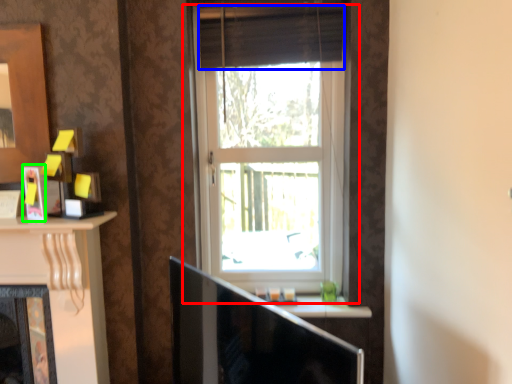
Question: Estimate the real-world distances between objects in this image. Which object is closer to window (highlighted by a red box), curtain (highlighted by a blue box) or picture frame (highlighted by a green box)?

Choices:
 (A) curtain
 (B) picture frame

Answer: (A)